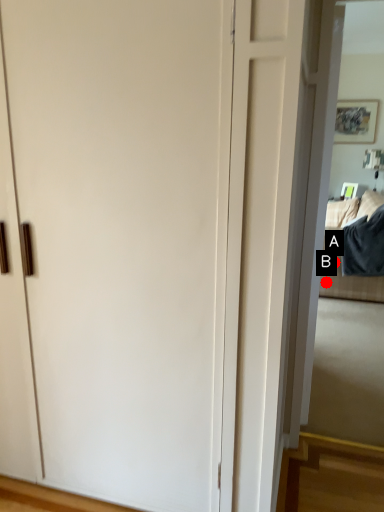
Question: Two points are circled on the image, labeled by A and B beside each circle. Among these points, which one is nearest to the camera?

Choices:
 (A) A is closer
 (B) B is closer

Answer: (B)